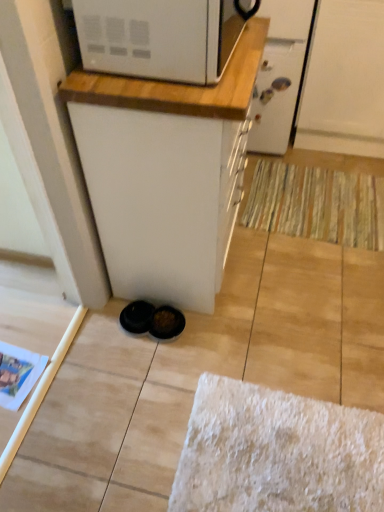
Find the location of a particular element. This screenshot has height=512, width=384. vacant area on top of striped fabric doormat at lower right (from a real-world perspective) is located at coordinates (322, 195).